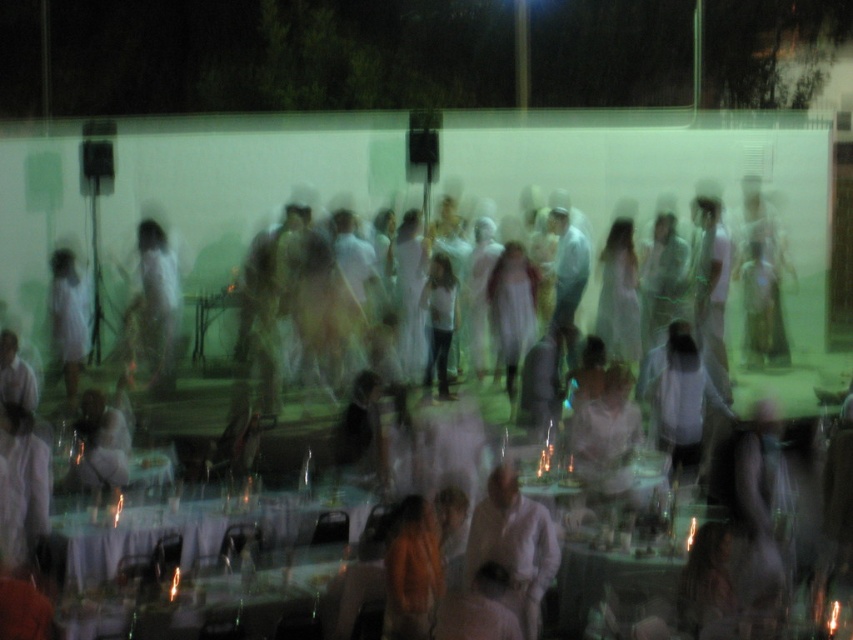
You are a photographer at the event and want to position yourself to capture both the white sheer fabric at center and the translucent glass table at center in the same frame. Based on their positions, which object should you place on the left side of your camera frame?

The white sheer fabric at center is to the left of the translucent glass table at center, so you should place the white sheer fabric at center on the left side of your camera frame.

You are a photographer at the event and want to capture a shot that includes both the white sheer fabric at center and the white lace tablecloth at lower left. Which object should you focus on first to ensure both are in frame without moving the camera?

You should focus on the white sheer fabric at center first since it is taller than the white lace tablecloth at lower left, ensuring both are captured in the frame without needing to adjust the camera position.